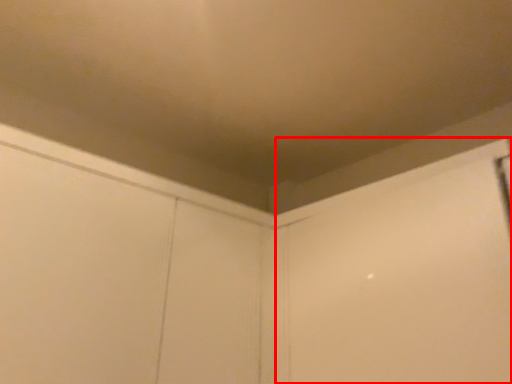
Question: Considering the relative positions of screen door (annotated by the red box) and screen door in the image provided, where is screen door (annotated by the red box) located with respect to the staircase?

Choices:
 (A) right
 (B) left

Answer: (A)